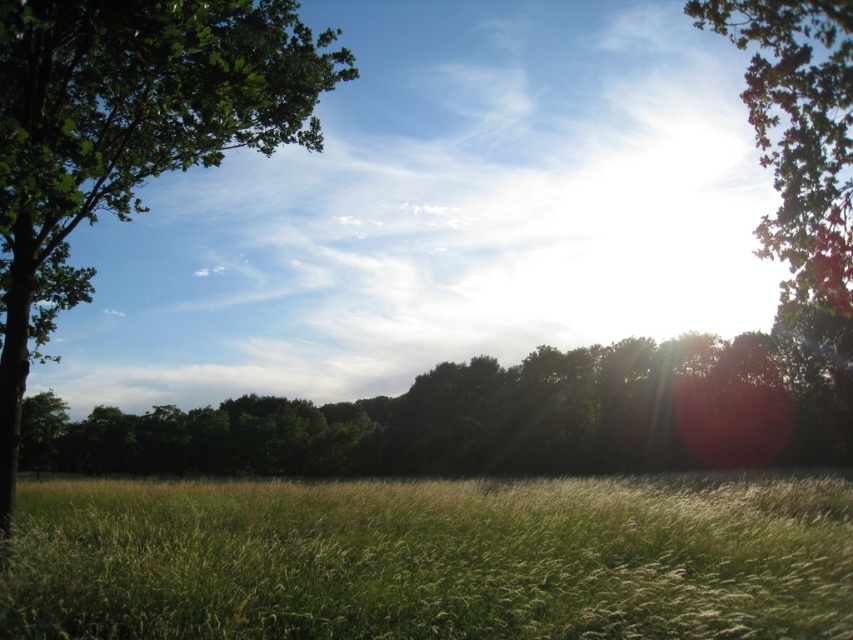
Which is below, green leafy tree at left or green leafy tree at upper right?

Positioned lower is green leafy tree at left.

In the scene shown: Between green leafy tree at left and green leafy tree at upper right, which one has more height?

Standing taller between the two is green leafy tree at upper right.

The width and height of the screenshot is (853, 640). Find the location of `green leafy tree at left`. green leafy tree at left is located at coordinates (126, 132).

Can you confirm if green grass at center is bigger than green leafy tree at upper right?

No.

Image resolution: width=853 pixels, height=640 pixels. I want to click on green grass at center, so click(432, 557).

Does green grass at center lie in front of green leafy tree at left?

That is True.

Which is in front, point (505, 573) or point (55, 60)?

Point (505, 573)

The width and height of the screenshot is (853, 640). Find the location of `green grass at center`. green grass at center is located at coordinates (432, 557).

Where is `green grass at center`? This screenshot has height=640, width=853. green grass at center is located at coordinates (432, 557).